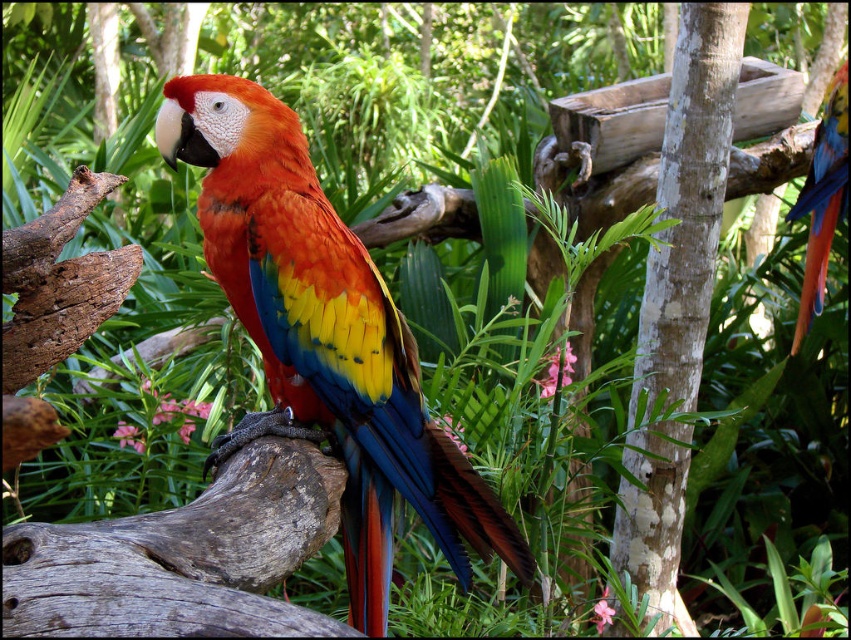
Question: Which is nearer to the shiny multicolored parrot at upper right?

Choices:
 (A) smooth bark tree trunk at center
 (B) glossy feathers parrot at center

Answer: (A)

Question: Does glossy feathers parrot at center come in front of smooth bark tree trunk at center?

Choices:
 (A) yes
 (B) no

Answer: (A)

Question: Does smooth bark tree trunk at center have a lesser width compared to shiny multicolored parrot at upper right?

Choices:
 (A) yes
 (B) no

Answer: (B)

Question: Estimate the real-world distances between objects in this image. Which object is closer to the smooth bark tree trunk at center?

Choices:
 (A) glossy feathers parrot at center
 (B) shiny multicolored parrot at upper right

Answer: (B)

Question: Which is nearer to the smooth bark tree trunk at center?

Choices:
 (A) shiny multicolored parrot at upper right
 (B) glossy feathers parrot at center

Answer: (A)

Question: Does glossy feathers parrot at center lie in front of shiny multicolored parrot at upper right?

Choices:
 (A) yes
 (B) no

Answer: (A)